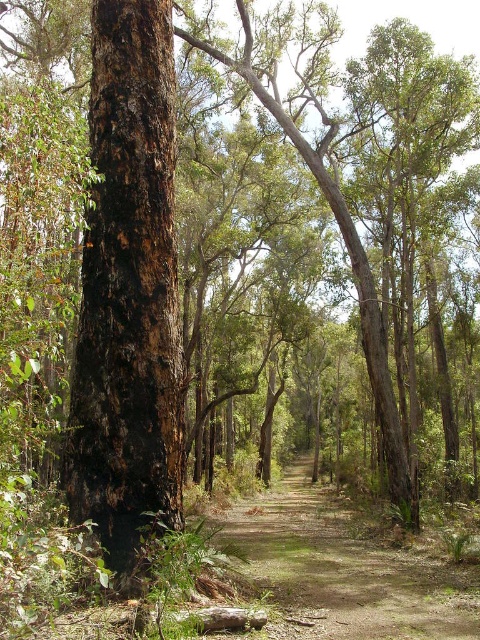
You are a hiker who wants to walk along the brown dirt track at center. However, there is a dark brown bark tree at center blocking your path. Can you walk around it on either side?

The dark brown bark tree at center is positioned over brown dirt track at center, so you can walk around it on either side since the tree is in the middle of the track.

You are a hiker trying to determine the best path through the forest. You see a dark brown bark tree at center and a brown dirt track at center. Which object is closer to the ground?

The dark brown bark tree at center is shorter than the brown dirt track at center, so the dark brown bark tree at center is closer to the ground.

You are standing at the point marked as point (156, 461) in the forest scene. The path ahead is 8.29 meters long. If you walk straight ahead along the path, how far will you have traveled when you reach the end of the visible path?

The distance between you and the viewer is 8.29 meters, so walking straight ahead along the path will take you 8.29 meters to reach the end of the visible path.